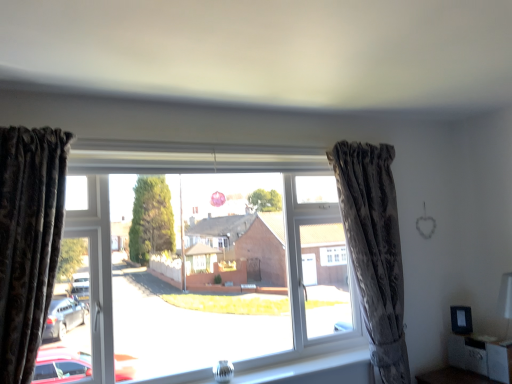
Question: Does camouflage fabric curtain at right, marked as the second curtain in a left-to-right arrangement, have a lesser width compared to clear glass vase at lower center?

Choices:
 (A) no
 (B) yes

Answer: (B)

Question: From a real-world perspective, is camouflage fabric curtain at right, marked as the second curtain in a left-to-right arrangement, physically below clear glass vase at lower center?

Choices:
 (A) no
 (B) yes

Answer: (A)

Question: Is camouflage fabric curtain at right, marked as the second curtain in a left-to-right arrangement, placed right next to clear glass vase at lower center?

Choices:
 (A) no
 (B) yes

Answer: (A)

Question: Is camouflage fabric curtain at right, marked as the second curtain in a left-to-right arrangement, shorter than clear glass vase at lower center?

Choices:
 (A) yes
 (B) no

Answer: (B)

Question: Is camouflage fabric curtain at right, which is the second curtain in front-to-back order, far away from clear glass vase at lower center?

Choices:
 (A) yes
 (B) no

Answer: (B)

Question: In terms of width, does velvet dark brown curtain at left, placed as the second curtain when sorted from back to front, look wider or thinner when compared to transparent glass window at center?

Choices:
 (A) thin
 (B) wide

Answer: (B)

Question: Would you say velvet dark brown curtain at left, placed as the second curtain when sorted from back to front, is to the left or to the right of transparent glass window at center in the picture?

Choices:
 (A) left
 (B) right

Answer: (A)

Question: From a real-world perspective, relative to transparent glass window at center, is velvet dark brown curtain at left, placed as the second curtain when sorted from back to front, vertically above or below?

Choices:
 (A) below
 (B) above

Answer: (B)

Question: Is point (41, 291) positioned closer to the camera than point (181, 347)?

Choices:
 (A) farther
 (B) closer

Answer: (B)

Question: From the image's perspective, is velvet dark brown curtain at left, placed as the second curtain when sorted from back to front, above or below clear glass vase at lower center?

Choices:
 (A) above
 (B) below

Answer: (A)

Question: From a real-world perspective, is velvet dark brown curtain at left, placed as the second curtain when sorted from back to front, physically located above or below clear glass vase at lower center?

Choices:
 (A) above
 (B) below

Answer: (A)

Question: Considering the positions of velvet dark brown curtain at left, the first curtain when ordered from front to back, and clear glass vase at lower center in the image, is velvet dark brown curtain at left, the first curtain when ordered from front to back, taller or shorter than clear glass vase at lower center?

Choices:
 (A) short
 (B) tall

Answer: (B)

Question: Considering the positions of velvet dark brown curtain at left, acting as the 2th curtain starting from the right, and clear glass vase at lower center in the image, is velvet dark brown curtain at left, acting as the 2th curtain starting from the right, wider or thinner than clear glass vase at lower center?

Choices:
 (A) wide
 (B) thin

Answer: (B)

Question: Does point (497, 365) appear closer or farther from the camera than point (373, 153)?

Choices:
 (A) closer
 (B) farther

Answer: (A)

Question: From a real-world perspective, is matte black cabinet at lower right positioned above or below camouflage fabric curtain at right, which is the first curtain in back-to-front order?

Choices:
 (A) above
 (B) below

Answer: (B)